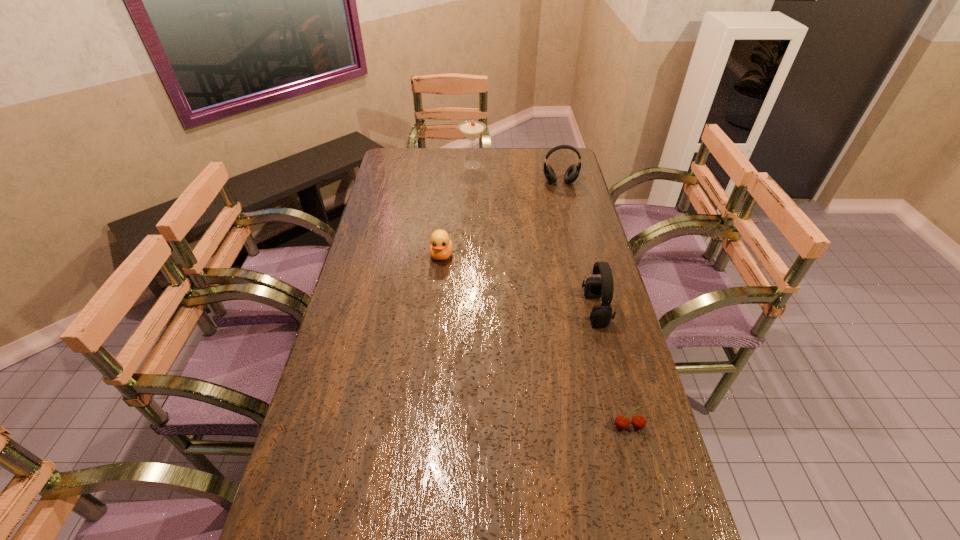
Where is `the second object from left to right`? the second object from left to right is located at coordinates (471, 129).

This screenshot has height=540, width=960. Identify the location of the farthest object. (471, 129).

Where is `the second nearest object`? The height and width of the screenshot is (540, 960). the second nearest object is located at coordinates (595, 287).

Where is `the farther headset`? This screenshot has width=960, height=540. the farther headset is located at coordinates (572, 173).

Identify the location of duckling. (441, 247).

Identify the location of the third farthest object. This screenshot has height=540, width=960. (441, 247).

I want to click on the shortest object, so click(x=622, y=422).

Image resolution: width=960 pixels, height=540 pixels. I want to click on cherry, so click(622, 422).

Locate an element on the screen. free location located on the front of the fourth object from right to left is located at coordinates (471, 221).

Where is `vacant position located on the headband of the second nearest object`? This screenshot has width=960, height=540. vacant position located on the headband of the second nearest object is located at coordinates (511, 309).